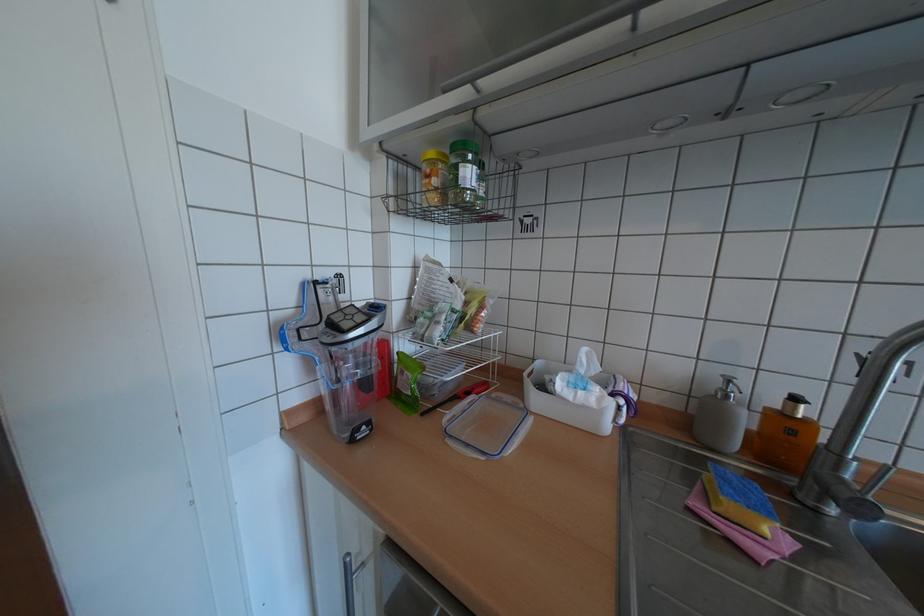
Identify the location of grey dispenser pump. (733, 378).